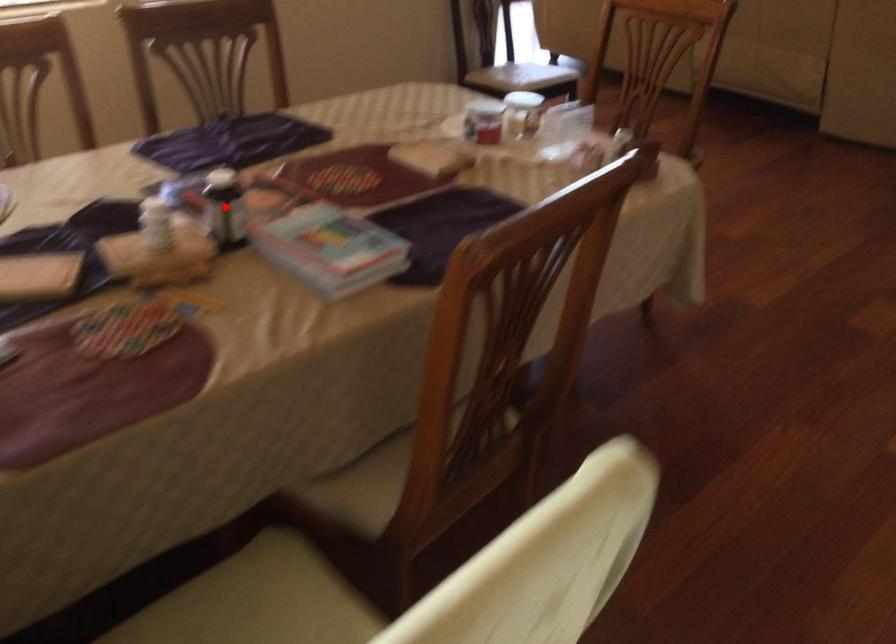
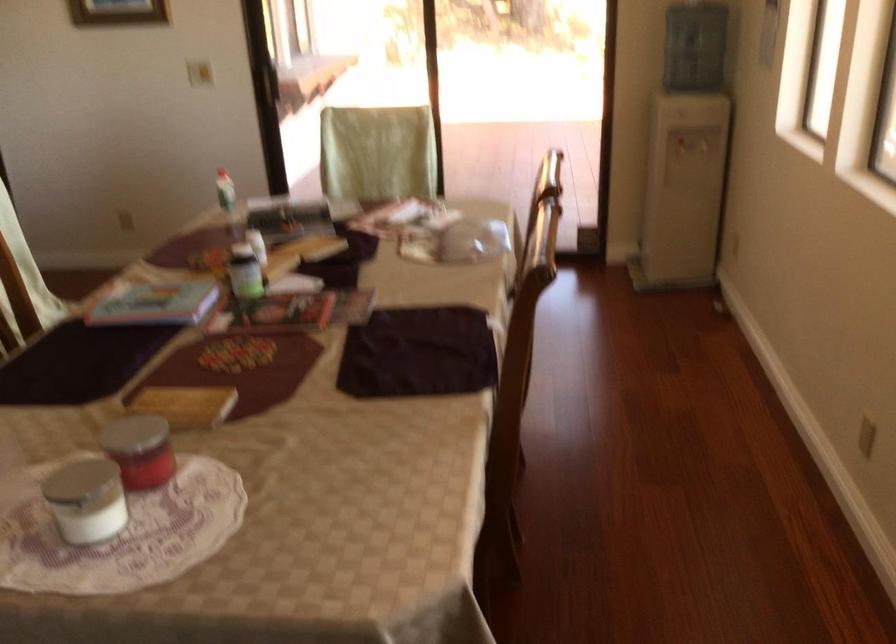
The point at the highlighted location is marked in the first image. Where is the corresponding point in the second image?

(245, 272)